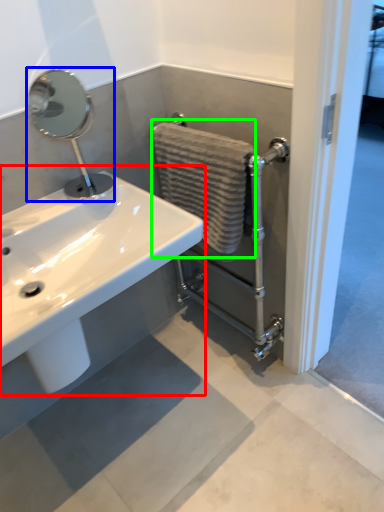
Question: Considering the real-world distances, which object is farthest from sink (highlighted by a red box)? plumbing fixture (highlighted by a blue box) or bath towel (highlighted by a green box)?

Choices:
 (A) plumbing fixture
 (B) bath towel

Answer: (A)